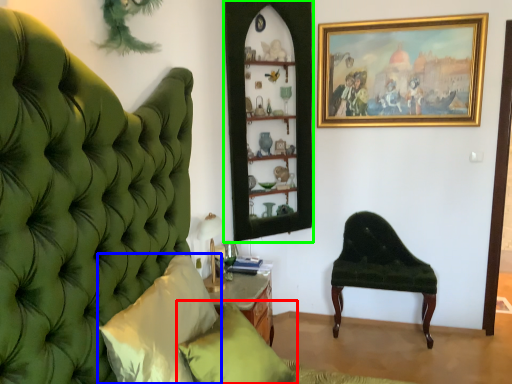
Question: Which object is the farthest from pillow (highlighted by a red box)? Choose among these: pillow (highlighted by a blue box) or shelf (highlighted by a green box).

Choices:
 (A) pillow
 (B) shelf

Answer: (B)